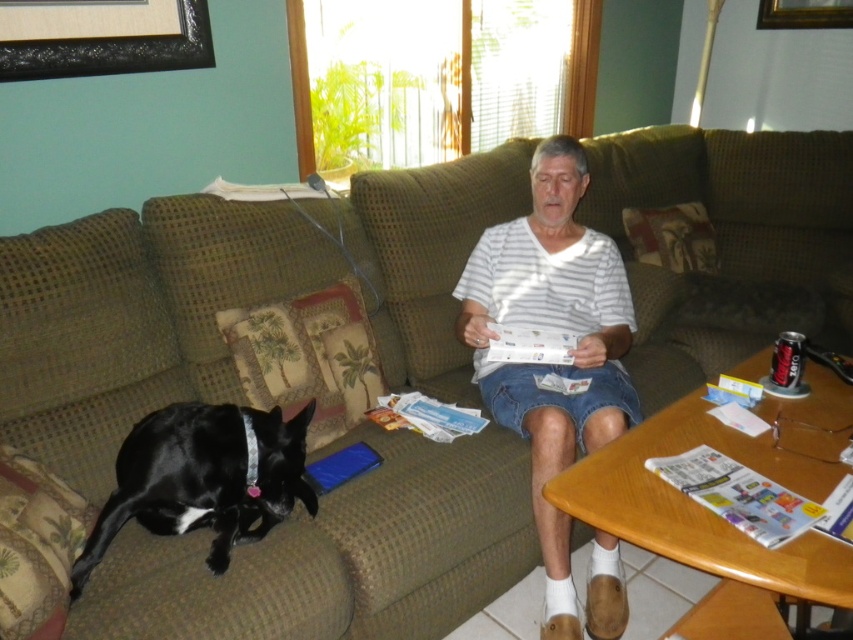
You are a photographer trying to capture a clear shot of both the black shiny dog at lower left and the gold wooden picture frame at upper right. Which object is positioned closer to you?

The black shiny dog at lower left is closer to the viewer than the gold wooden picture frame at upper right.

You are a guest in the living room and want to place a small plant on the table between the black shiny dog at lower left and the black matte picture frame at upper left. Is there enough vertical space between them to fit the plant?

The black shiny dog at lower left is below the black matte picture frame at upper left, so there is sufficient vertical space between them to place the small plant.

You are a visitor in the living room and want to know which object is taller between the black shiny dog at lower left and the gold wooden picture frame at upper right. Can you tell me?

The black shiny dog at lower left has a greater height compared to the gold wooden picture frame at upper right, so the black shiny dog at lower left is taller.